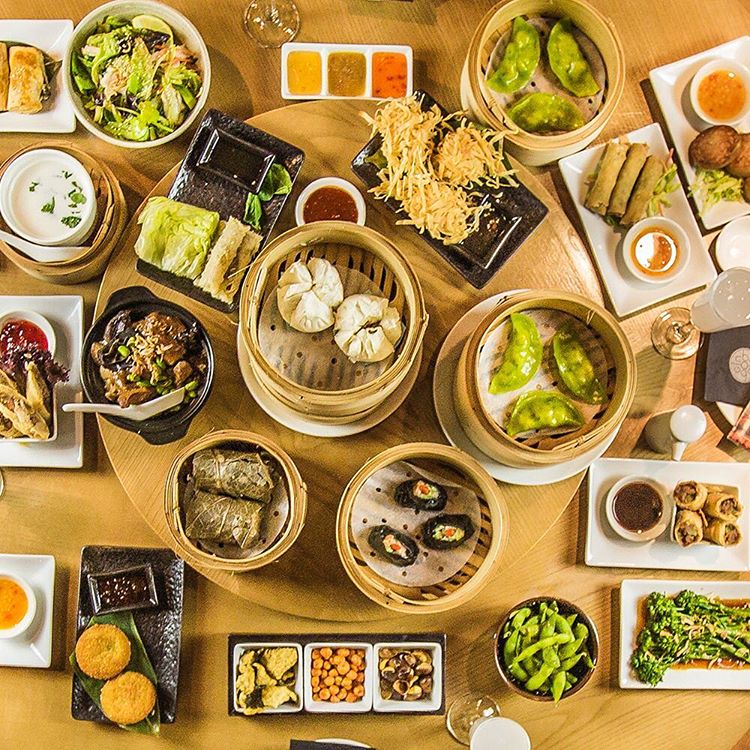
Image resolution: width=750 pixels, height=750 pixels. In order to click on spoon in this screenshot , I will do `click(164, 397)`, `click(55, 255)`.